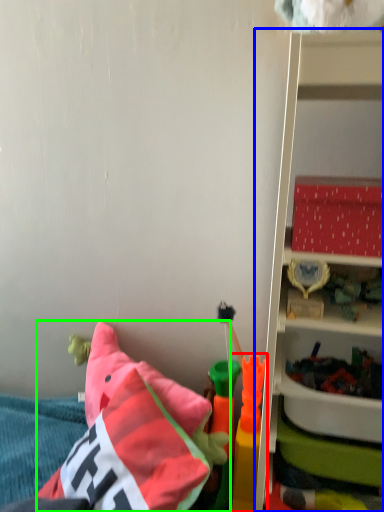
Question: Which object is positioned closest to toy (highlighted by a red box)? Select from shelf (highlighted by a blue box) and pillow (highlighted by a green box).

Choices:
 (A) shelf
 (B) pillow

Answer: (B)